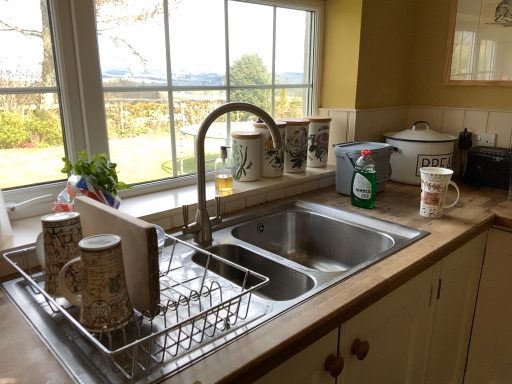
Identify the location of empty space that is to the right of white ceramic mug at right, the 1th mug in the right-to-left sequence. (464, 209).